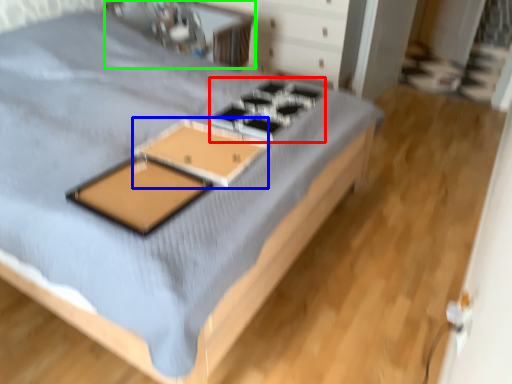
Question: Which is farther away from gas stove (highlighted by a red box)? table (highlighted by a blue box) or table (highlighted by a green box)?

Choices:
 (A) table
 (B) table

Answer: (B)